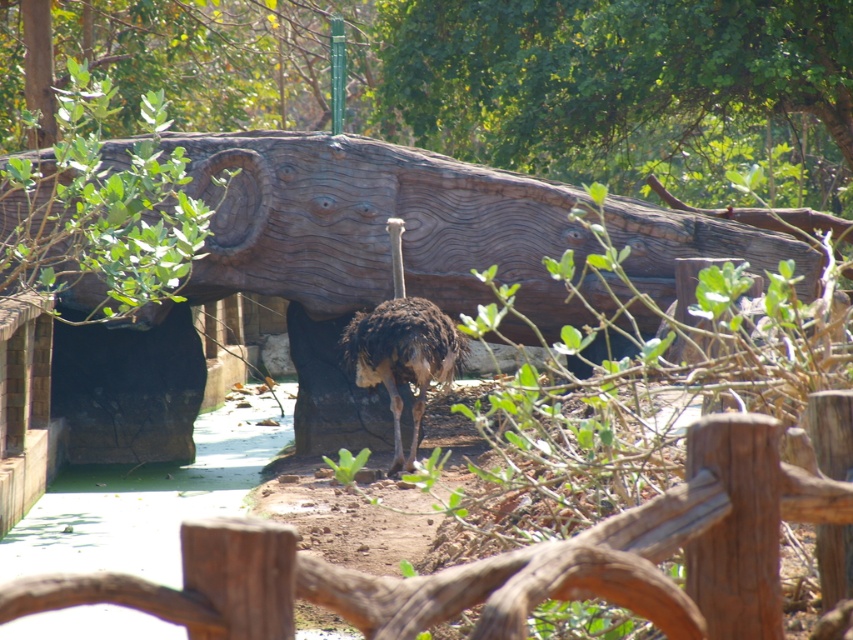
You are a zookeeper trying to place a new sign between the wooden log at center and the brown wooden fence at center. According to the scene, which object should the sign be placed to the left of?

The wooden log at center is to the right of the brown wooden fence at center, so the sign should be placed to the left of the brown wooden fence at center.